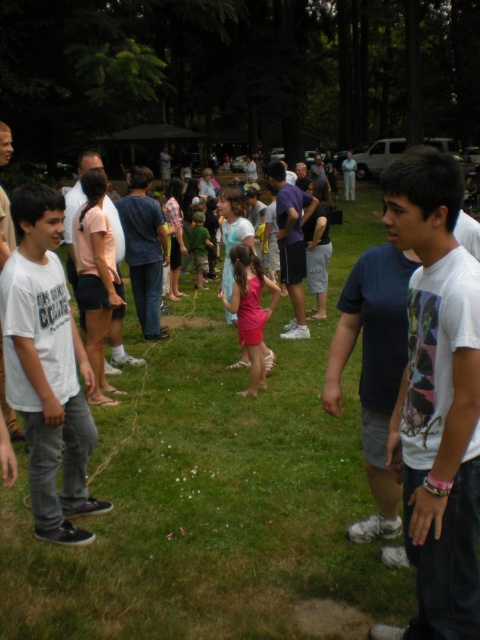
You are a photographer at this event and want to capture both the pink satin dress at center and the green camouflage shirt at center in the same frame. Based on their positions, which one is closer to the camera?

The pink satin dress at center is below the green camouflage shirt at center, so the green camouflage shirt at center is closer to the camera.

You are a photographer at the event and want to capture a photo that includes both the white cotton shirt at left and the green camouflage shirt at center. Based on their positions, which shirt should you focus on first to ensure both are in the frame?

The white cotton shirt at left is located below the green camouflage shirt at center, so you should focus on the green camouflage shirt at center first to ensure both are in the frame.